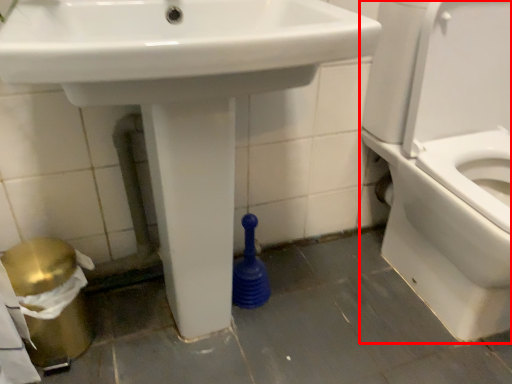
Question: From the image's perspective, considering the relative positions of toilet (annotated by the red box) and sink in the image provided, where is toilet (annotated by the red box) located with respect to the staircase?

Choices:
 (A) above
 (B) below

Answer: (A)